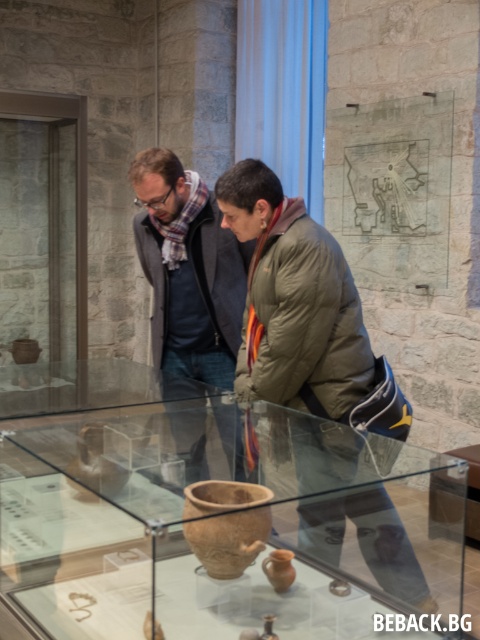
Question: Is green matte jacket at center behind matte gray jacket at center?

Choices:
 (A) yes
 (B) no

Answer: (B)

Question: Which point is closer to the camera?

Choices:
 (A) [x=226, y=556]
 (B) [x=176, y=340]
 (C) [x=252, y=340]

Answer: (A)

Question: Estimate the real-world distances between objects in this image. Which object is farther from the brown matte pot at center?

Choices:
 (A) transparent glass box at center
 (B) matte gray jacket at center
 (C) green matte jacket at center

Answer: (B)

Question: Which object appears closest to the camera in this image?

Choices:
 (A) matte gray jacket at center
 (B) green matte jacket at center

Answer: (B)

Question: Does transparent glass box at center have a greater width compared to matte gray jacket at center?

Choices:
 (A) yes
 (B) no

Answer: (A)

Question: Is green matte jacket at center below brown matte pot at center?

Choices:
 (A) no
 (B) yes

Answer: (A)